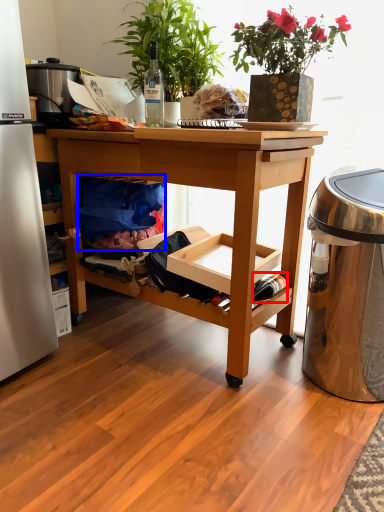
Question: Which of the following is the closest to the observer, bottle (highlighted by a red box) or material (highlighted by a blue box)?

Choices:
 (A) bottle
 (B) material

Answer: (A)